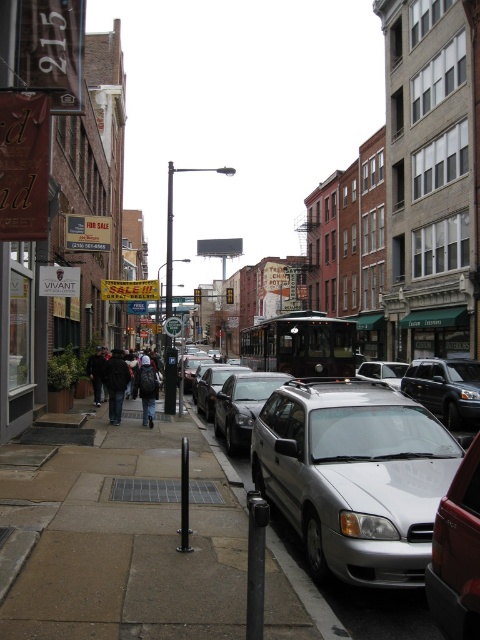
You are standing at the point with coordinates 0.5, 0.25 in the image. You want to walk to the dark gray jacket at center. Which direction should you move?

Since the dark gray jacket at center is located at point (127, 384), you should move to the right to reach it.

You are a delivery person with a 4 feet wide cart. You need to navigate through the sidewalk between the dark gray jacket at center and the dark brown leather jacket at lower left. Can your cart fit through the space between them?

The distance between the dark gray jacket at center and the dark brown leather jacket at lower left is 4.41 feet. Since your cart is 4 feet wide, it can fit through the space between them as there is enough clearance.